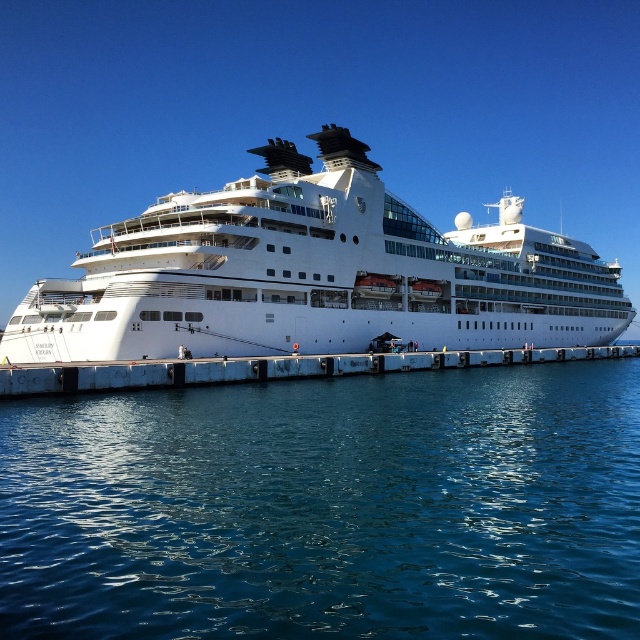
Is blue liquid water at lower center wider than white glossy cruise ship at center?

In fact, blue liquid water at lower center might be narrower than white glossy cruise ship at center.

Can you confirm if blue liquid water at lower center is smaller than white glossy cruise ship at center?

Indeed, blue liquid water at lower center has a smaller size compared to white glossy cruise ship at center.

Is point (394, 472) positioned before point (275, 296)?

Yes, point (394, 472) is closer to viewer.

I want to click on blue liquid water at lower center, so click(x=328, y=508).

Measure the distance between point (330, 323) and camera.

A distance of 82.60 meters exists between point (330, 323) and camera.

Is white glossy cruise ship at center to the right of white concrete dock at center from the viewer's perspective?

No, white glossy cruise ship at center is not to the right of white concrete dock at center.

Identify the location of white glossy cruise ship at center. This screenshot has height=640, width=640. (314, 273).

Find the location of a particular element. This screenshot has height=640, width=640. white glossy cruise ship at center is located at coordinates (314, 273).

The height and width of the screenshot is (640, 640). Identify the location of blue liquid water at lower center. (328, 508).

Can you confirm if blue liquid water at lower center is wider than white concrete dock at center?

No.

Is point (404, 586) behind point (442, 360)?

That is False.

Locate an element on the screen. blue liquid water at lower center is located at coordinates (328, 508).